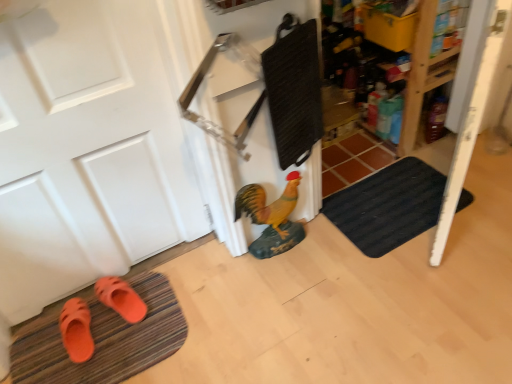
Where is `free space behind orange rubber slipper at lower left, which ranks as the 2th footwear in left-to-right order`? The width and height of the screenshot is (512, 384). free space behind orange rubber slipper at lower left, which ranks as the 2th footwear in left-to-right order is located at coordinates (139, 277).